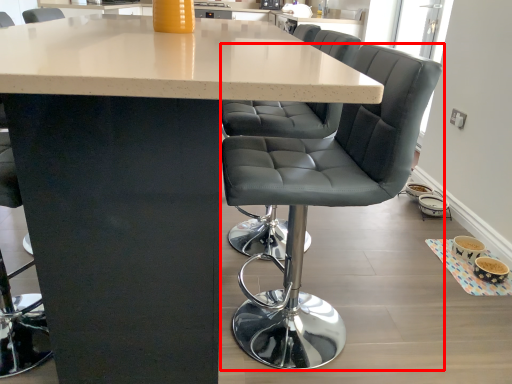
Question: From the image's perspective, considering the relative positions of chair (annotated by the red box) and table in the image provided, where is chair (annotated by the red box) located with respect to the staircase?

Choices:
 (A) below
 (B) above

Answer: (A)